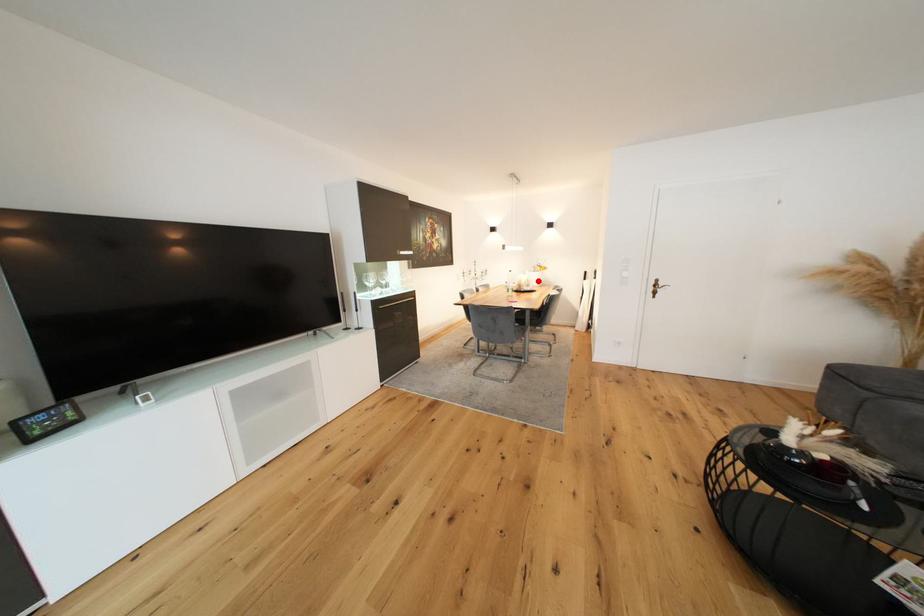
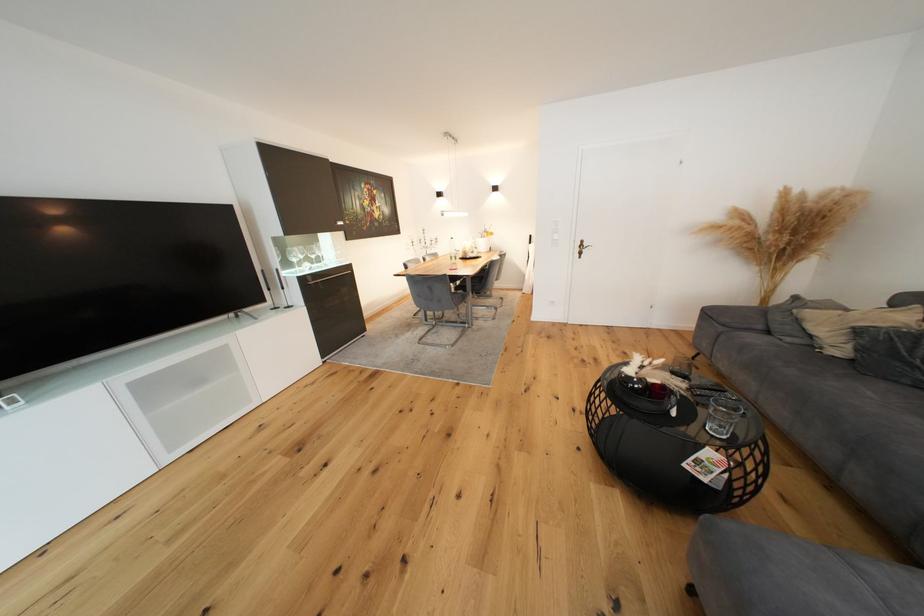
Find the pixel in the second image that matches the highlighted location in the first image.

(489, 246)